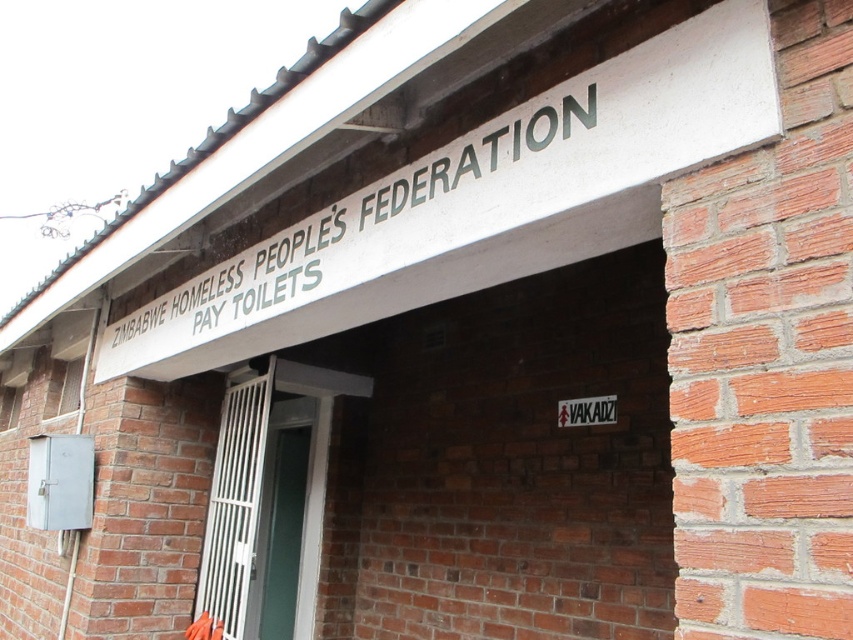
You are a maintenance worker standing at the entrance of the building. You need to clean the white metallic sign at upper center. Can you reach it without using a ladder?

The white metallic sign at upper center is 4.24 feet away from the viewer. Since the average human arm length is about 2.5 feet, you cannot reach it without a ladder.

You are standing at the entrance of the building and see two points marked on the wall. The first point is at coordinate point (772, 88) and the second is at point (294, 509). Which point is closer to you as you face the building entrance?

Point (772, 88) is closer to you because it is in front of point (294, 509).